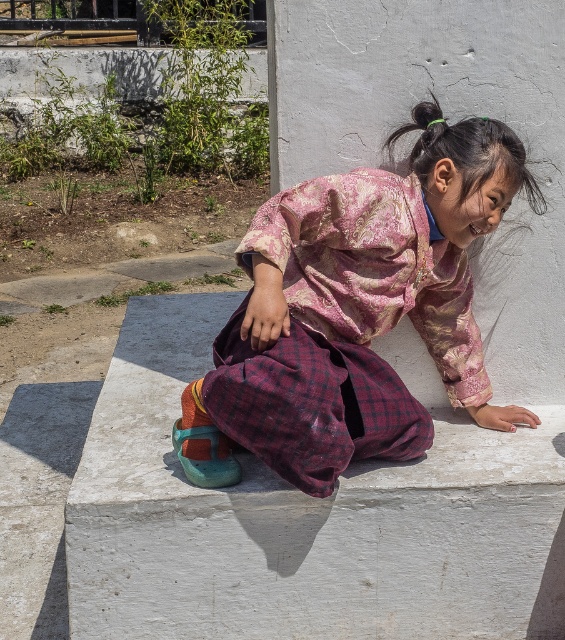
You are standing in the scene and want to place a small potted plant exactly at the point marked as point (302, 520). According to the image, what type of surface will the potted plant be placed on?

The white concrete at center is located at point (302, 520), so the potted plant will be placed on the white concrete at center.

You are a construction worker inspecting the ground in the image. You see the white concrete at center and the white smooth concrete at center. Which one is located to the left?

The white concrete at center is positioned on the left side of white smooth concrete at center.